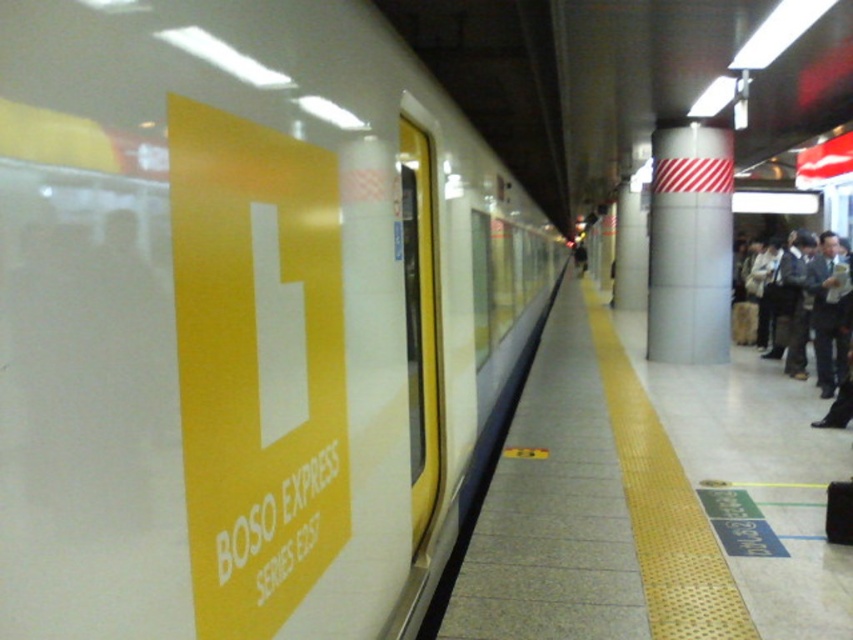
Question: Is white glossy train at left above white glossy pillar at center?

Choices:
 (A) yes
 (B) no

Answer: (B)

Question: Does white glossy pillar at center have a greater width compared to dark gray suit at right?

Choices:
 (A) no
 (B) yes

Answer: (B)

Question: Which is nearer to the dark gray suit at right?

Choices:
 (A) white glossy train at left
 (B) white glossy pillar at center

Answer: (B)

Question: Can you confirm if yellow rubber platform at center is bigger than white glossy pillar at center?

Choices:
 (A) no
 (B) yes

Answer: (B)

Question: Which object appears closest to the camera in this image?

Choices:
 (A) dark gray suit at right
 (B) white glossy train at left
 (C) white glossy pillar at center

Answer: (B)

Question: Which point is closer to the camera?

Choices:
 (A) (817, 307)
 (B) (515, 337)
 (C) (798, 609)
 (D) (728, 214)

Answer: (C)